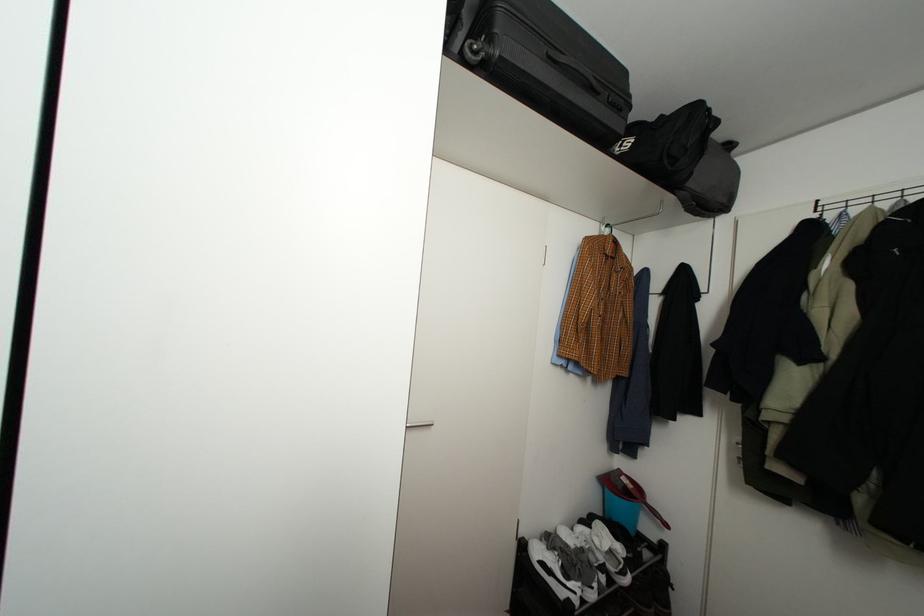
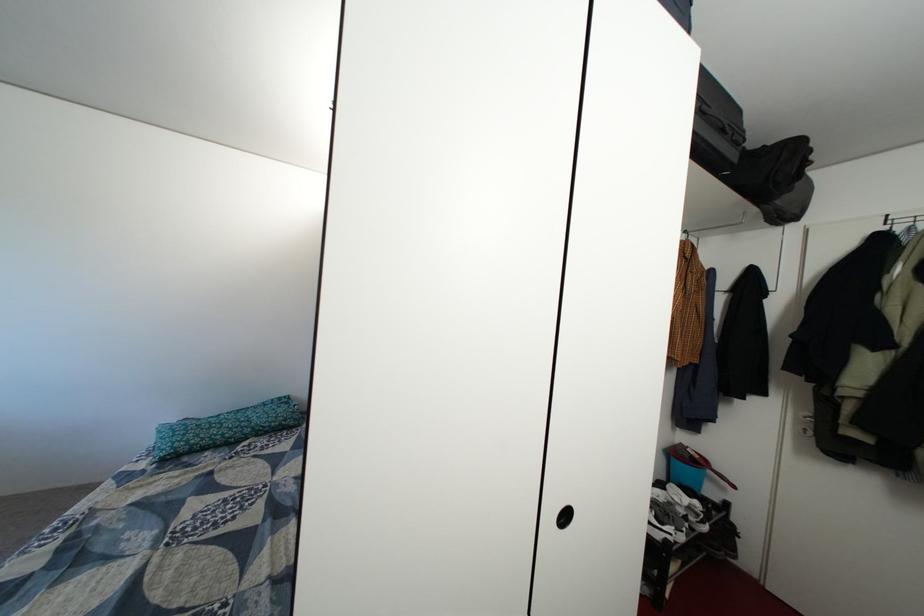
Where in the second image is the point corresponding to (x=648, y=500) from the first image?

(713, 469)